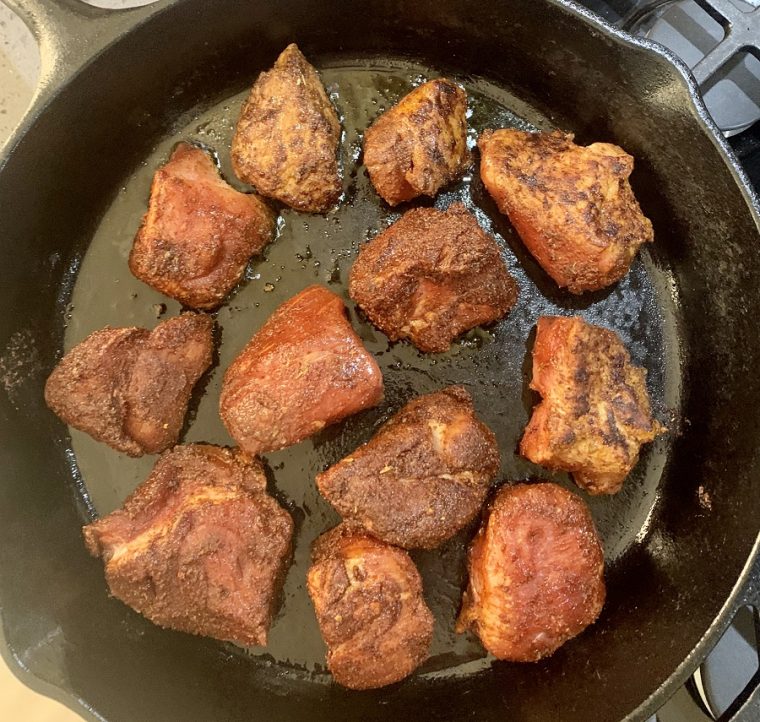
Where is `bottom of pan`? The height and width of the screenshot is (722, 760). bottom of pan is located at coordinates (289, 274).